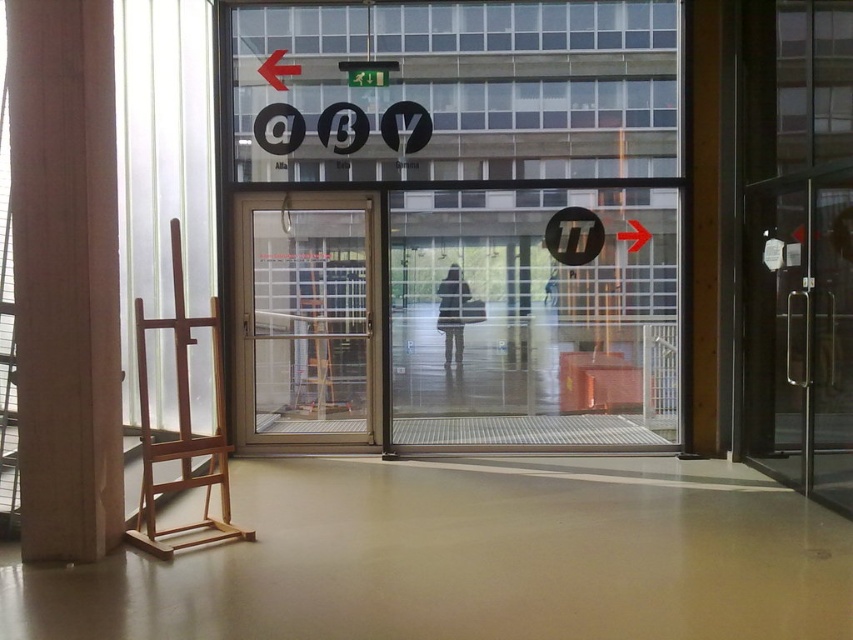
Question: Which object is the farthest from the red plastic arrow at upper left?

Choices:
 (A) gold metallic door at center
 (B) transparent glass arrow at right

Answer: (B)

Question: Is gold metallic door at center thinner than transparent glass arrow at right?

Choices:
 (A) no
 (B) yes

Answer: (A)

Question: Based on their relative distances, which object is farther from the gold metallic door at center?

Choices:
 (A) red plastic arrow at upper left
 (B) transparent glass arrow at right

Answer: (B)

Question: Does gold metallic door at center have a smaller size compared to transparent glass arrow at right?

Choices:
 (A) no
 (B) yes

Answer: (A)

Question: Based on their relative distances, which object is farther from the transparent glass arrow at right?

Choices:
 (A) gold metallic door at center
 (B) red plastic arrow at upper left

Answer: (B)

Question: Can you confirm if red plastic arrow at upper left is positioned below transparent glass arrow at right?

Choices:
 (A) yes
 (B) no

Answer: (B)